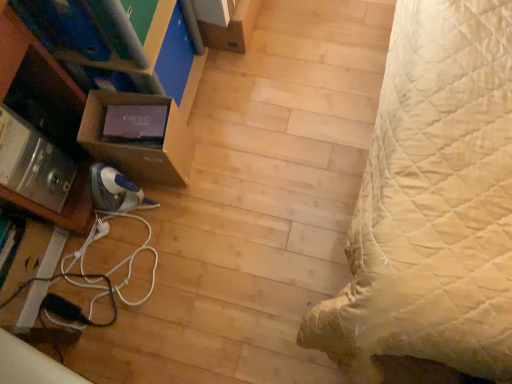
At what (x,y) coordinates should I click in order to perform the action: click on vacant space to the right of white cord at lower left. Please return your answer as a coordinate pair (x, y). Looking at the image, I should click on (204, 248).